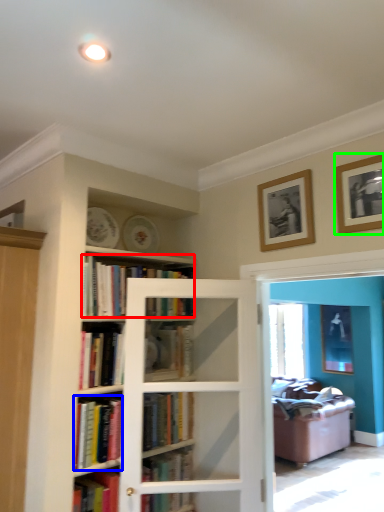
Question: Based on their relative distances, which object is nearer to book (highlighted by a red box)? Choose from book (highlighted by a blue box) and picture frame (highlighted by a green box).

Choices:
 (A) book
 (B) picture frame

Answer: (A)